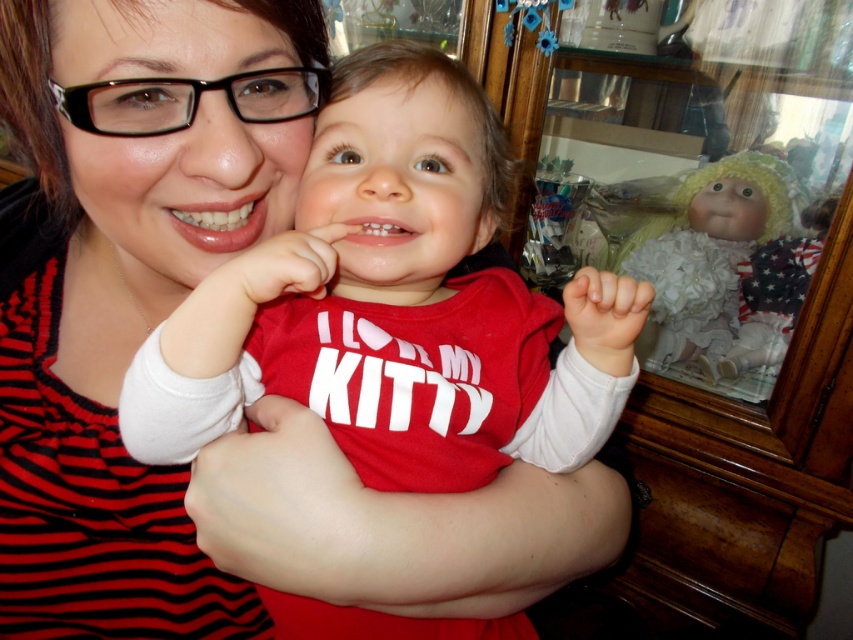
You are a photographer trying to capture a closeup of the white fluffy doll at right while ensuring the matte red shirt at center is still visible in the frame. Can you position yourself in a way that both objects are in the shot?

The matte red shirt at center is below the white fluffy doll at right, so positioning the camera slightly above the white fluffy doll at right would allow both objects to be captured in the frame.

You are a delivery robot with a height of 1.2 meters. You need to deliver a package to the point marked at coordinates point (x=19, y=461). The package must be placed exactly at that point. Considering the height of the objects in the scene, will you be able to place the package without it being obstructed by any objects?

The distance of point (x=19, y=461) from viewer is 59.41 centimeters. Since the delivery robot is 1.2 meters tall, it can easily reach and place the package at the specified point without obstruction as the height is sufficient to overcome any potential obstacles in the scene.